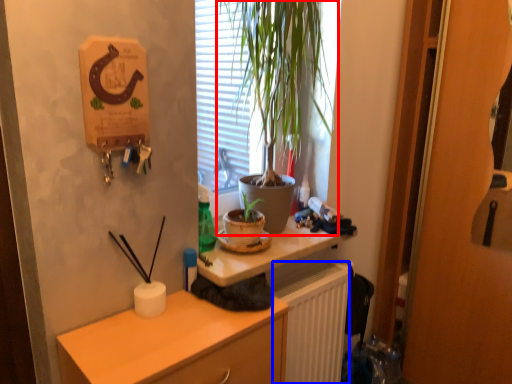
Question: Which object appears closest to the camera in this image, houseplant (highlighted by a red box) or radiator (highlighted by a blue box)?

Choices:
 (A) houseplant
 (B) radiator

Answer: (A)